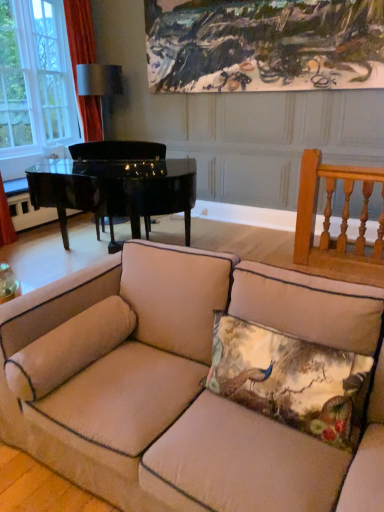
Question: From the image's perspective, relative to black polished piano at left, is beige fabric couch at center above or below?

Choices:
 (A) below
 (B) above

Answer: (A)

Question: Would you say beige fabric couch at center is to the left or to the right of black polished piano at left in the picture?

Choices:
 (A) left
 (B) right

Answer: (B)

Question: Which of these objects is positioned farthest from the silky floral pillow at center, positioned as the second pillow in left-to-right order?

Choices:
 (A) orange fabric curtain at upper left
 (B) beige fabric pillow at lower left, which ranks as the second pillow in right-to-left order
 (C) white fabric lampshade at upper center
 (D) beige fabric couch at center
 (E) black polished piano at left

Answer: (C)

Question: Based on their relative distances, which object is nearer to the clear glass window at upper left?

Choices:
 (A) black polished piano at left
 (B) white fabric lampshade at upper center
 (C) beige fabric pillow at lower left, which ranks as the first pillow in left-to-right order
 (D) silky floral pillow at center, positioned as the second pillow in left-to-right order
 (E) orange fabric curtain at upper left

Answer: (E)